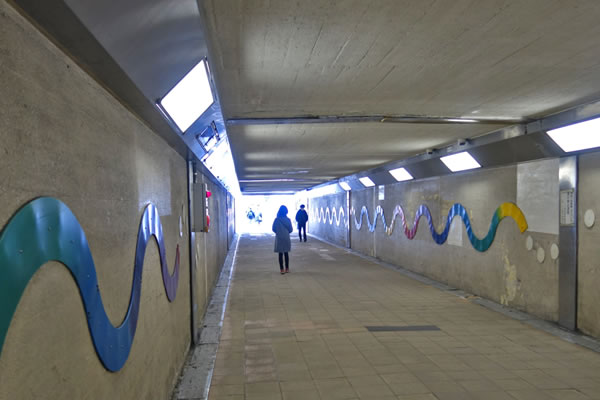
Where is `right wall`? Image resolution: width=600 pixels, height=400 pixels. right wall is located at coordinates (484, 194).